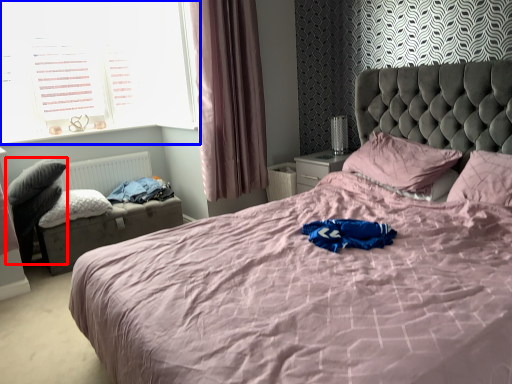
Question: Which of the following is the farthest to the observer, swivel chair (highlighted by a red box) or window (highlighted by a blue box)?

Choices:
 (A) swivel chair
 (B) window

Answer: (B)